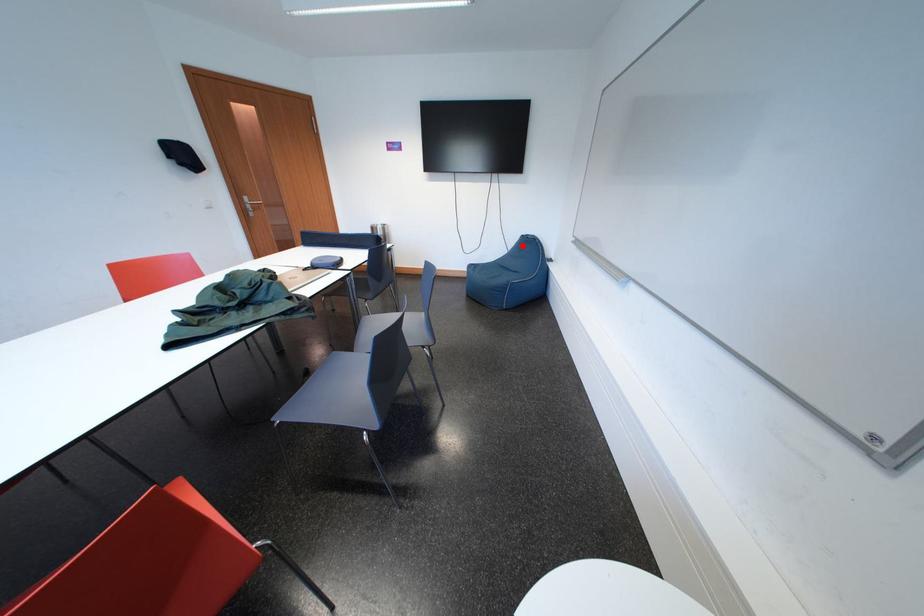
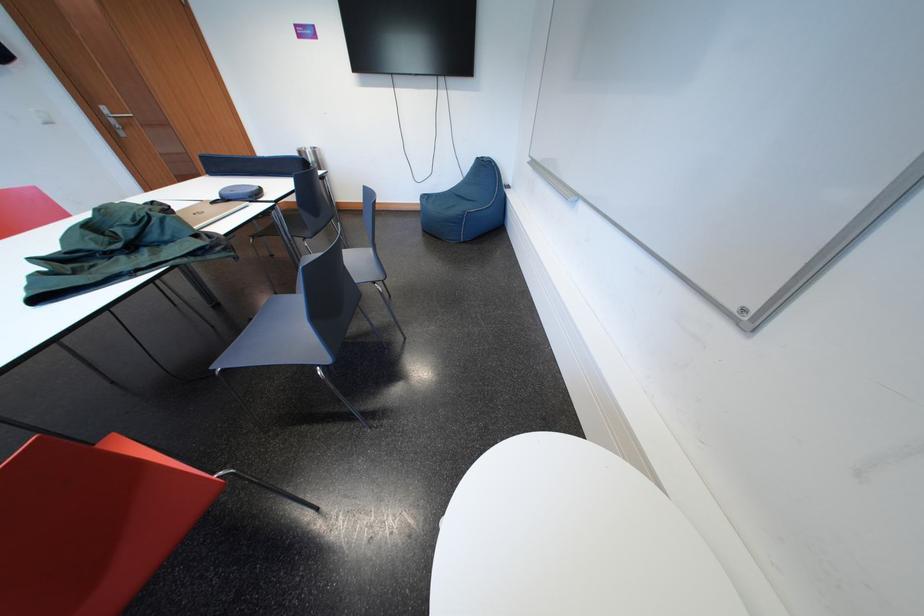
The point at the highlighted location is marked in the first image. Where is the corresponding point in the second image?

(477, 169)